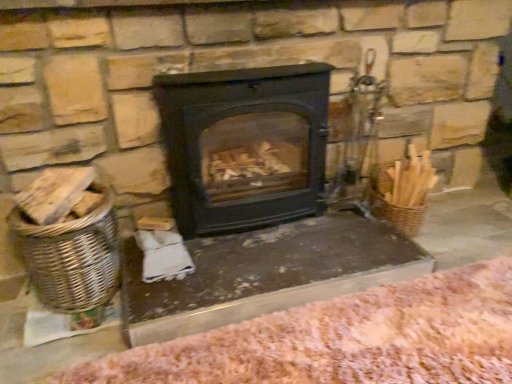
What do you see at coordinates (244, 145) in the screenshot? I see `black matte wood burning stove at center` at bounding box center [244, 145].

Where is `woven brown basket at left`? Image resolution: width=512 pixels, height=384 pixels. woven brown basket at left is located at coordinates (70, 257).

You are a GUI agent. You are given a task and a screenshot of the screen. Output one action in this format:
    pyautogui.click(x=<x>, y=<y>)
    Task: Click on the pink woolen blanket at lower right
    
    Given the screenshot: What is the action you would take?
    [x=344, y=340]

Is woven brown basket at left to the left of smooth stone table at center from the viewer's perspective?

Indeed, woven brown basket at left is positioned on the left side of smooth stone table at center.

Considering their positions, is woven brown basket at left located in front of or behind smooth stone table at center?

woven brown basket at left is in front of smooth stone table at center.

Is smooth stone table at center completely or partially inside woven brown basket at left?

Actually, smooth stone table at center is outside woven brown basket at left.

From the picture: Can you confirm if woven brown basket at left is shorter than smooth stone table at center?

No.

Can black matte wood burning stove at center be found inside woven brown basket at left?

Actually, black matte wood burning stove at center is outside woven brown basket at left.

Considering the positions of objects woven brown basket at left and black matte wood burning stove at center in the image provided, who is more to the right, woven brown basket at left or black matte wood burning stove at center?

From the viewer's perspective, black matte wood burning stove at center appears more on the right side.

Does point (76, 305) come farther from viewer compared to point (210, 183)?

That is False.

Is woven brown basket at left positioned with its back to black matte wood burning stove at center?

No, black matte wood burning stove at center is not at the back of woven brown basket at left.

Which is in front, point (197, 340) or point (62, 260)?

Point (197, 340)

From a real-world perspective, is pink woolen blanket at lower right physically located above or below woven brown basket at left?

From a real-world perspective, pink woolen blanket at lower right is physically below woven brown basket at left.

Which of these two, pink woolen blanket at lower right or woven brown basket at left, is bigger?

Bigger between the two is pink woolen blanket at lower right.

Are pink woolen blanket at lower right and woven brown basket at left located far from each other?

Actually, pink woolen blanket at lower right and woven brown basket at left are a little close together.

Measure the distance between smooth stone table at center and pink woolen blanket at lower right.

17.82 centimeters.

Consider the image. From a real-world perspective, is smooth stone table at center above or below pink woolen blanket at lower right?

In terms of real-world spatial position, smooth stone table at center is above pink woolen blanket at lower right.

Considering the positions of objects smooth stone table at center and pink woolen blanket at lower right in the image provided, who is more to the right, smooth stone table at center or pink woolen blanket at lower right?

Positioned to the right is pink woolen blanket at lower right.

Which is in front, black matte wood burning stove at center or pink woolen blanket at lower right?

pink woolen blanket at lower right is in front.

Is black matte wood burning stove at center to the left of pink woolen blanket at lower right from the viewer's perspective?

Yes, black matte wood burning stove at center is to the left of pink woolen blanket at lower right.

Looking at this image, would you say black matte wood burning stove at center is inside or outside pink woolen blanket at lower right?

black matte wood burning stove at center is outside pink woolen blanket at lower right.

Is black matte wood burning stove at center next to pink woolen blanket at lower right and touching it?

black matte wood burning stove at center and pink woolen blanket at lower right are clearly separated.

From their relative heights in the image, would you say pink woolen blanket at lower right is taller or shorter than black matte wood burning stove at center?

Clearly, pink woolen blanket at lower right is shorter compared to black matte wood burning stove at center.

Is pink woolen blanket at lower right completely or partially outside of black matte wood burning stove at center?

Yes.

What's the angular difference between pink woolen blanket at lower right and black matte wood burning stove at center's facing directions?

pink woolen blanket at lower right and black matte wood burning stove at center are facing 2.32 degrees away from each other.

Is black matte wood burning stove at center taller than woven brown basket at left?

Indeed, black matte wood burning stove at center has a greater height compared to woven brown basket at left.

From the picture: Is black matte wood burning stove at center not close to woven brown basket at left?

black matte wood burning stove at center is near woven brown basket at left, not far away.

Based on the photo, from a real-world perspective, which is physically below, black matte wood burning stove at center or woven brown basket at left?

woven brown basket at left, from a real-world perspective.

Considering the points (290, 116) and (16, 225), which point is behind, point (290, 116) or point (16, 225)?

The point (290, 116) is more distant.

Find the location of a particular element. basket on the left of smooth stone table at center is located at coordinates pos(70,257).

Identify the location of wood burning stove on the right of woven brown basket at left. (244, 145).

Looking at the image, which one is located closer to woven brown basket at left, smooth stone table at center or pink woolen blanket at lower right?

The object closer to woven brown basket at left is smooth stone table at center.

Considering their positions, is smooth stone table at center positioned further to black matte wood burning stove at center than pink woolen blanket at lower right?

pink woolen blanket at lower right is further to black matte wood burning stove at center.

From the image, which object appears to be nearer to black matte wood burning stove at center, woven brown basket at left or pink woolen blanket at lower right?

woven brown basket at left.

Estimate the real-world distances between objects in this image. Which object is further from smooth stone table at center, pink woolen blanket at lower right or black matte wood burning stove at center?

black matte wood burning stove at center is further to smooth stone table at center.

From the image, which object appears to be farther from pink woolen blanket at lower right, smooth stone table at center or woven brown basket at left?

The object further to pink woolen blanket at lower right is woven brown basket at left.

Looking at the image, which one is located further to black matte wood burning stove at center, pink woolen blanket at lower right or woven brown basket at left?

pink woolen blanket at lower right is positioned further to the anchor black matte wood burning stove at center.

Estimate the real-world distances between objects in this image. Which object is further from pink woolen blanket at lower right, woven brown basket at left or black matte wood burning stove at center?

black matte wood burning stove at center is further to pink woolen blanket at lower right.

Looking at the image, which one is located closer to smooth stone table at center, woven brown basket at left or black matte wood burning stove at center?

black matte wood burning stove at center is positioned closer to the anchor smooth stone table at center.

You are a GUI agent. You are given a task and a screenshot of the screen. Output one action in this format:
    pyautogui.click(x=<x>, y=<y>)
    Task: Click on the wood burning stove between woven brown basket at left and pink woolen blanket at lower right from left to right
    The width and height of the screenshot is (512, 384).
    Given the screenshot: What is the action you would take?
    pyautogui.click(x=244, y=145)

This screenshot has height=384, width=512. I want to click on table between black matte wood burning stove at center and pink woolen blanket at lower right in the vertical direction, so coord(265,274).

This screenshot has width=512, height=384. In order to click on wood burning stove situated between woven brown basket at left and smooth stone table at center from left to right in this screenshot , I will do `click(244, 145)`.

This screenshot has width=512, height=384. I want to click on table between woven brown basket at left and pink woolen blanket at lower right from left to right, so click(265, 274).